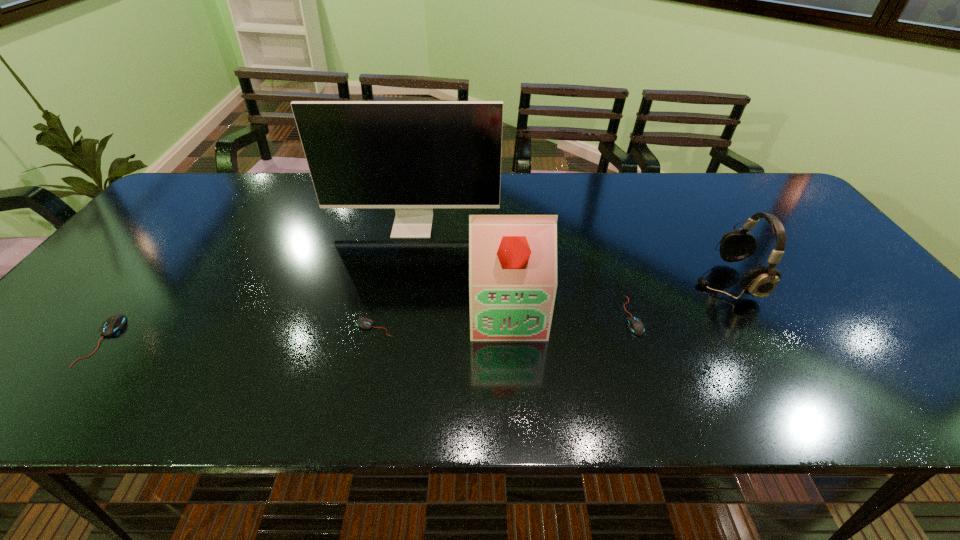
Observe the arrangement of all mouses in the image. To keep them evenly spaced, where would you place another mouse on the right? Please locate a free space. Please provide its 2D coordinates. Your answer should be formatted as a tuple, i.e. [(x, y)], where the tuple contains the x and y coordinates of a point satisfying the conditions above.

[(876, 305)]